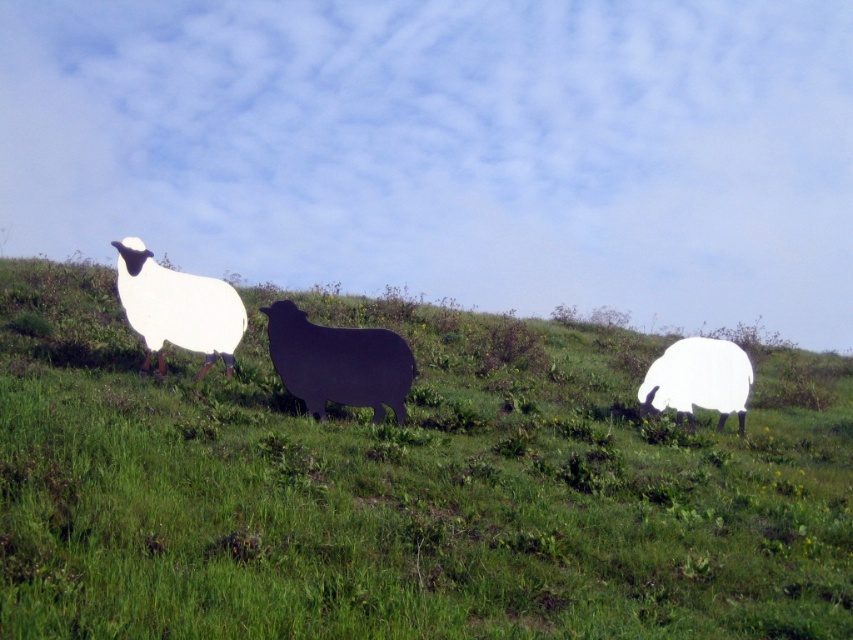
Question: Is green grassy at center below white matte sheep at right?

Choices:
 (A) no
 (B) yes

Answer: (A)

Question: Estimate the real-world distances between objects in this image. Which object is closer to the white matte sheep at left?

Choices:
 (A) white matte sheep at right
 (B) green grassy at center
 (C) black matte sheep at center

Answer: (C)

Question: Which object is farther from the camera taking this photo?

Choices:
 (A) white matte sheep at left
 (B) green grassy at center
 (C) black matte sheep at center

Answer: (A)

Question: Is green grassy at center thinner than white matte sheep at right?

Choices:
 (A) yes
 (B) no

Answer: (B)

Question: Does green grassy at center appear on the right side of white matte sheep at right?

Choices:
 (A) no
 (B) yes

Answer: (A)

Question: Based on their relative distances, which object is nearer to the black matte sheep at center?

Choices:
 (A) white matte sheep at left
 (B) white matte sheep at right

Answer: (A)